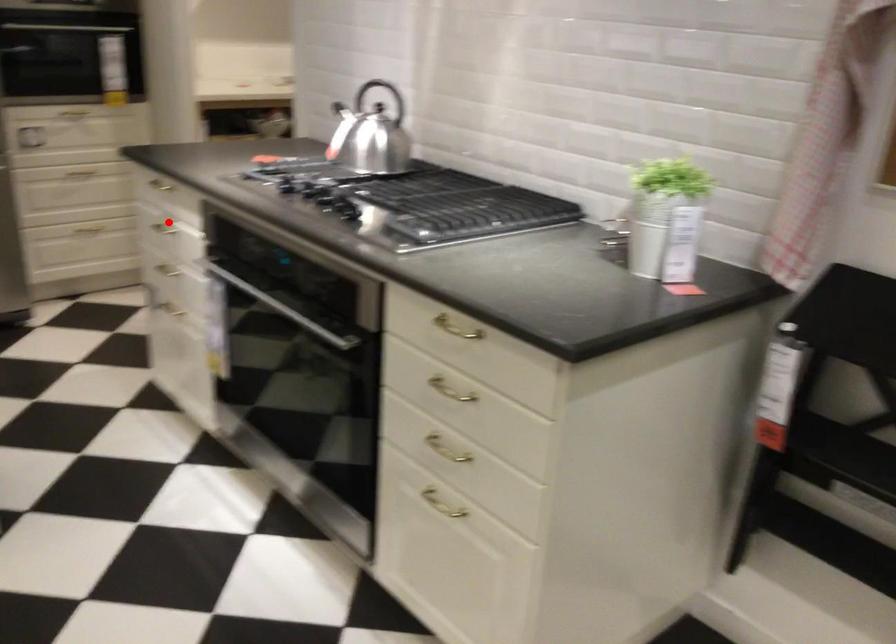
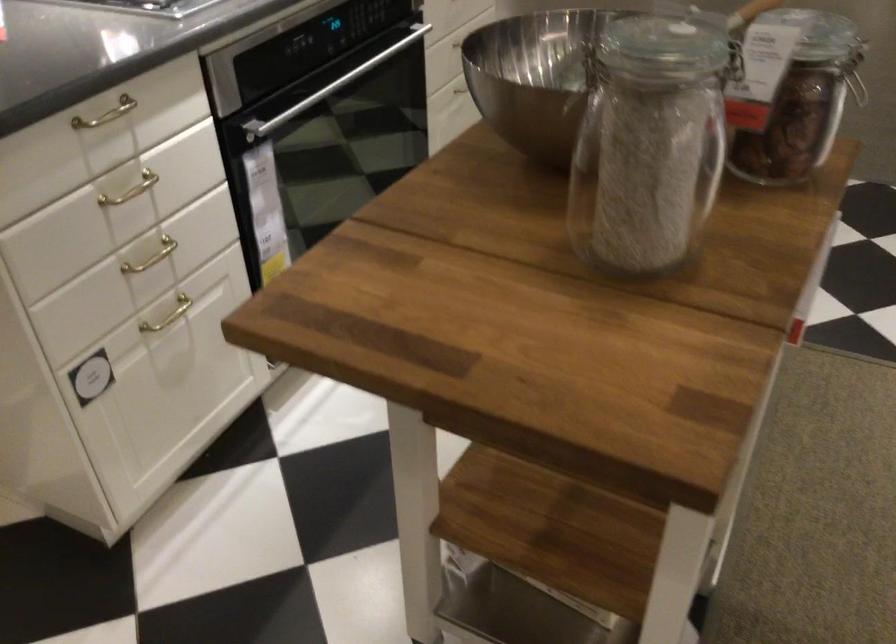
Question: I am providing you with two images of the same scene from different viewpoints. A red point is shown in image1. For the corresponding object point in image2, is it positioned nearer or farther from the camera?

Choices:
 (A) Nearer
 (B) Farther

Answer: (A)